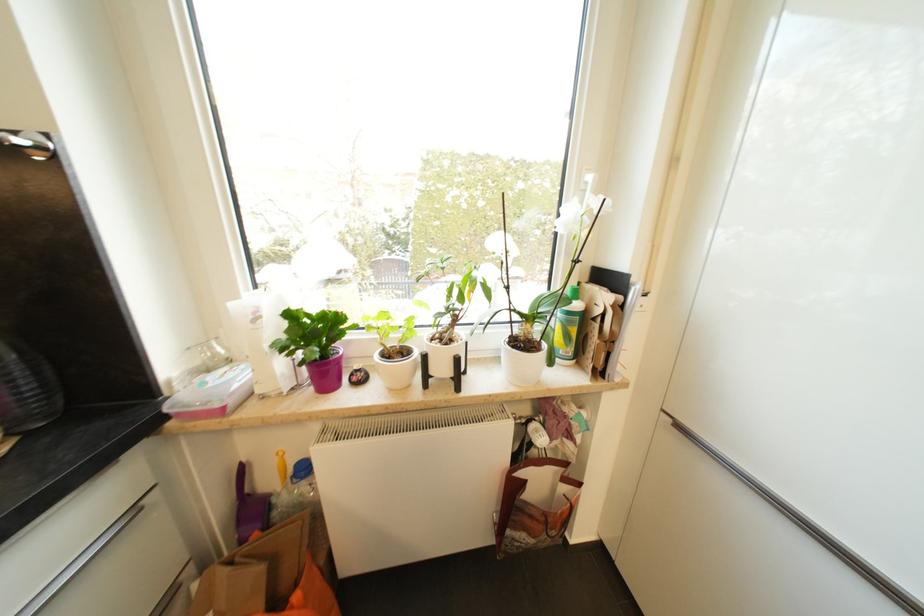
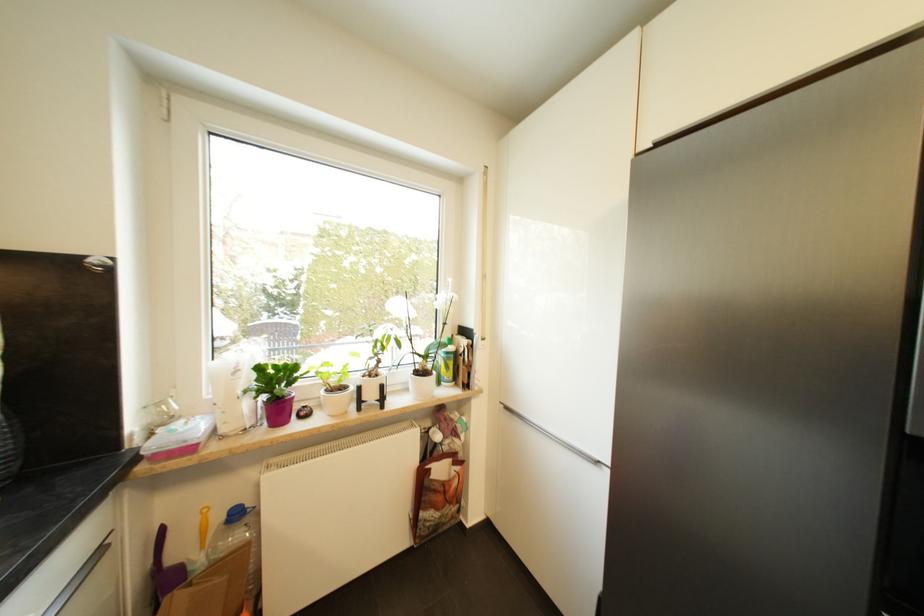
Find the pixel in the second image that matches point 574,315 in the first image.

(453, 355)